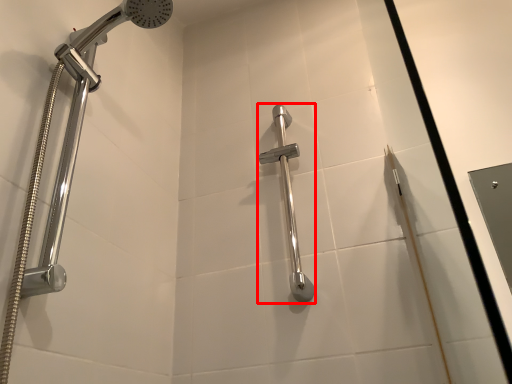
Question: From the image's perspective, considering the relative positions of shower (annotated by the red box) and shower in the image provided, where is shower (annotated by the red box) located with respect to the staircase?

Choices:
 (A) below
 (B) above

Answer: (A)